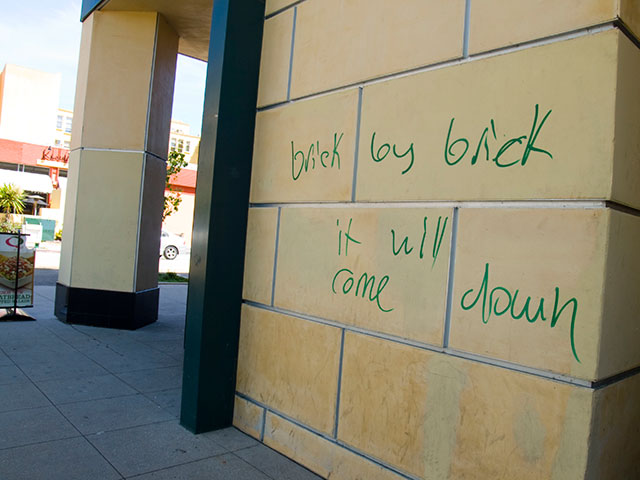
Where is `edge of the wall`? Image resolution: width=640 pixels, height=480 pixels. edge of the wall is located at coordinates (223, 204).